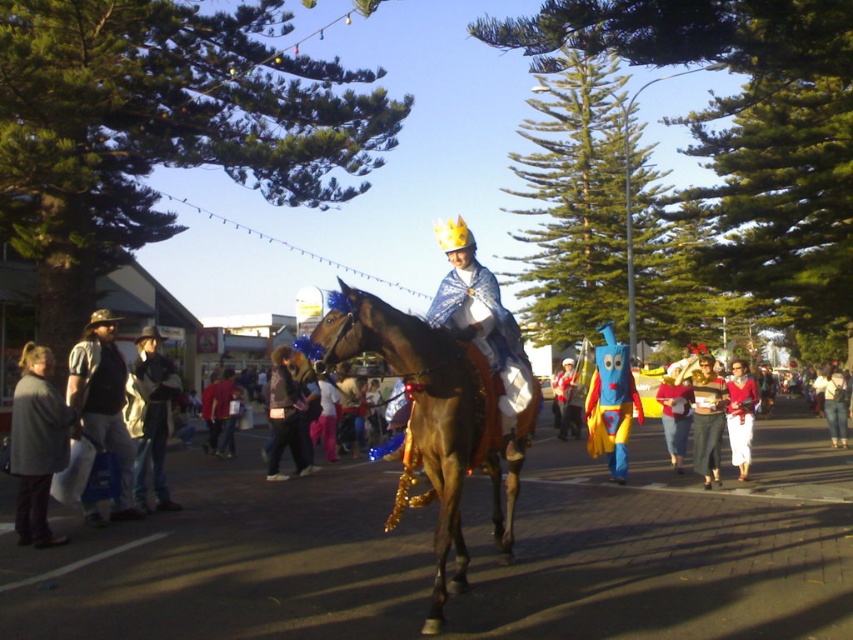
You are standing at the point with coordinates point (100,420) and want to walk towards the point with coordinates point (329,291). Will you be moving forward or backward relative to your current position?

Since point (329,291) is behind point (100,420), moving towards it would mean you are moving backward relative to your current position at point (100,420).

In the scene shown: You are a street performer standing at the edge of the parade route. You need to move a 2.5 meter long banner pole from the brushed metal vest at left to the brown shiny horse at center. Is there enough space to move the pole without hitting anything?

The distance between the brown shiny horse at center and the brushed metal vest at left is 3.46 meters. Since the banner pole is 2.5 meters long, there is sufficient space to move it between them without any obstruction.

You are a photographer standing at the center of the street. You want to take a photo of the brown shiny horse at center. Where should you aim your camera to capture the horse in the frame?

You should aim your camera at point (432, 419) to capture the brown shiny horse at center in the frame.